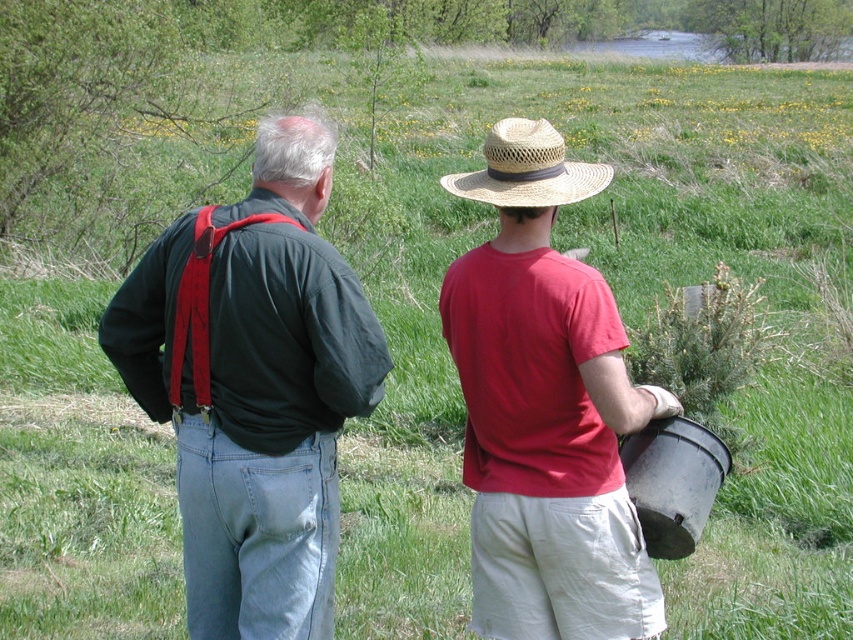
How distant is dark green shirt at left from straw/textured cowboy hat at center?

A distance of 1.28 meters exists between dark green shirt at left and straw/textured cowboy hat at center.

Is dark green shirt at left behind straw/textured cowboy hat at center?

No.

Find the location of `dark green shirt at left`. dark green shirt at left is located at coordinates (253, 387).

The image size is (853, 640). Describe the element at coordinates (253, 387) in the screenshot. I see `dark green shirt at left` at that location.

Between dark green shirt at left and straw hat at center, which one has less height?

straw hat at center

You are a GUI agent. You are given a task and a screenshot of the screen. Output one action in this format:
    pyautogui.click(x=<x>, y=<y>)
    Task: Click on the dark green shirt at left
    The image size is (853, 640).
    Given the screenshot: What is the action you would take?
    pyautogui.click(x=253, y=387)

Does straw hat at center have a greater width compared to straw/textured cowboy hat at center?

Correct, the width of straw hat at center exceeds that of straw/textured cowboy hat at center.

Who is more forward, (578, 177) or (532, 193)?

Point (532, 193)

The width and height of the screenshot is (853, 640). Identify the location of straw hat at center. (544, 408).